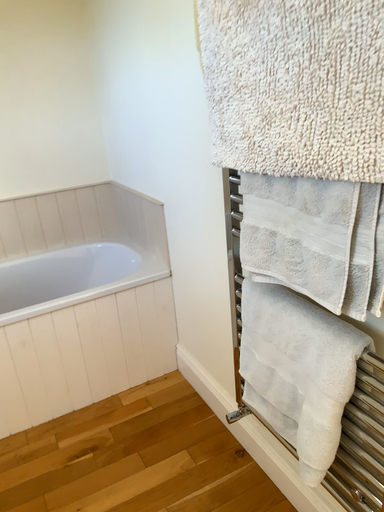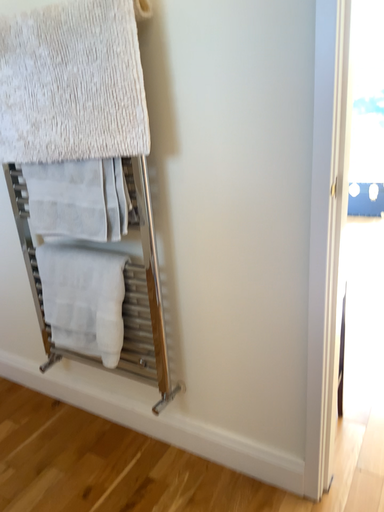
Question: Which way did the camera rotate in the video?

Choices:
 (A) rotated left
 (B) rotated right

Answer: (B)